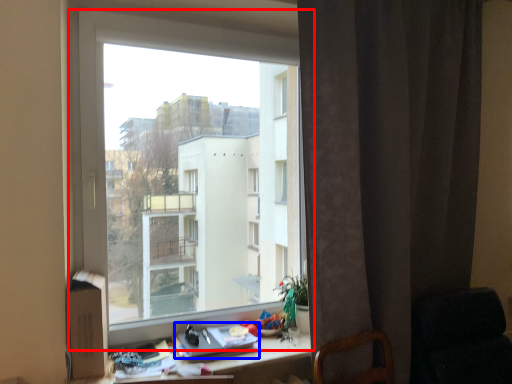
Question: Which object is closer to the camera taking this photo, window (highlighted by a red box) or book (highlighted by a blue box)?

Choices:
 (A) window
 (B) book

Answer: (A)